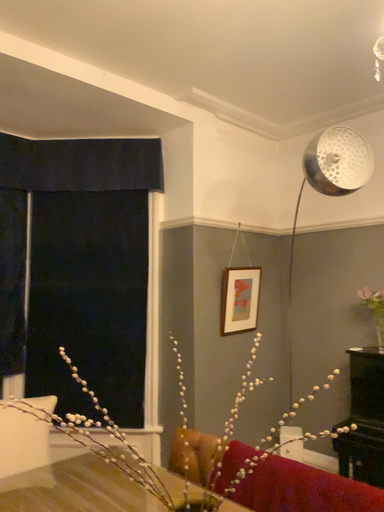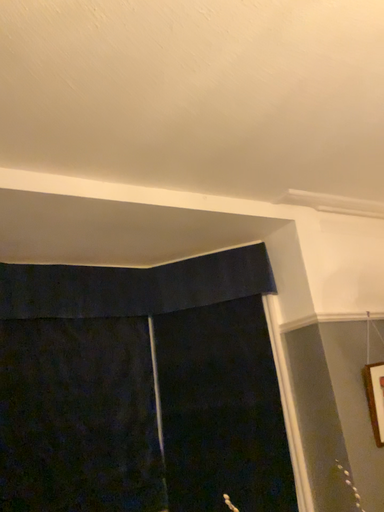
Question: How did the camera likely rotate when shooting the video?

Choices:
 (A) rotated upward
 (B) rotated downward

Answer: (A)